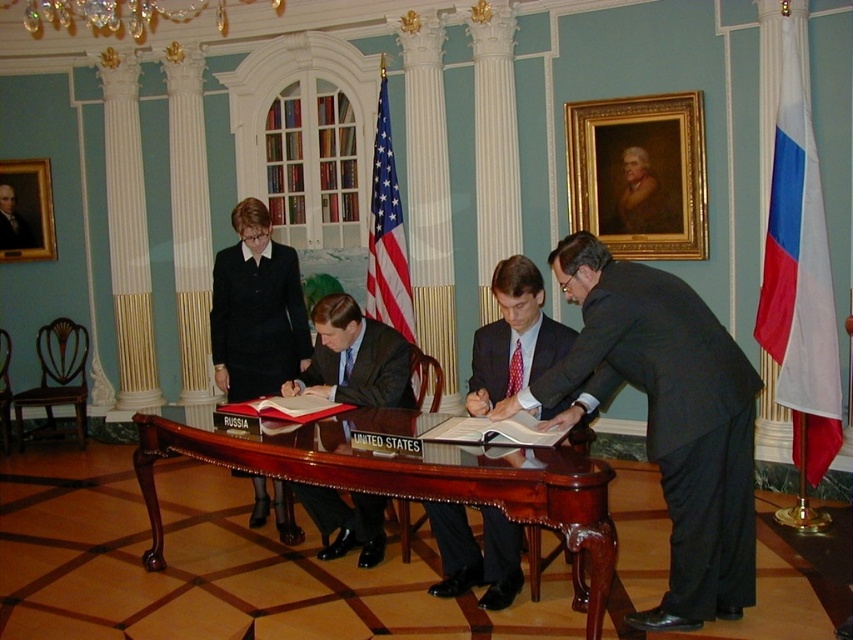
You are a photographer taking a picture of the signing ceremony. You notice two points of interest marked at coordinates point [488,348] and point [404,300]. Which point is closer to your camera lens?

Point [488,348] is closer to the camera than point [404,300].

You are attending this signing ceremony and want to approach the person wearing the black matte suit at center to shake hands. However, there is another person in a smooth black suit at center in your path. Which individual should you approach first to avoid obstruction?

You should approach the black matte suit at center first since it is closer to you than the smooth black suit at center, so you can reach them without needing to go around the other person.

You are attending a signing ceremony in a grand room with light blue walls and gold accents. You see a mahogany wood table at center and a dark blue suit at center. Which object is positioned higher in the image?

The dark blue suit at center is positioned higher because the mahogany wood table at center is located below it.